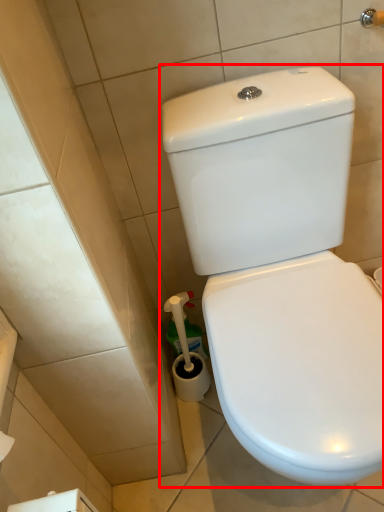
Question: From the image's perspective, considering the relative positions of toilet (annotated by the red box) and brush in the image provided, where is toilet (annotated by the red box) located with respect to the staircase?

Choices:
 (A) above
 (B) below

Answer: (A)